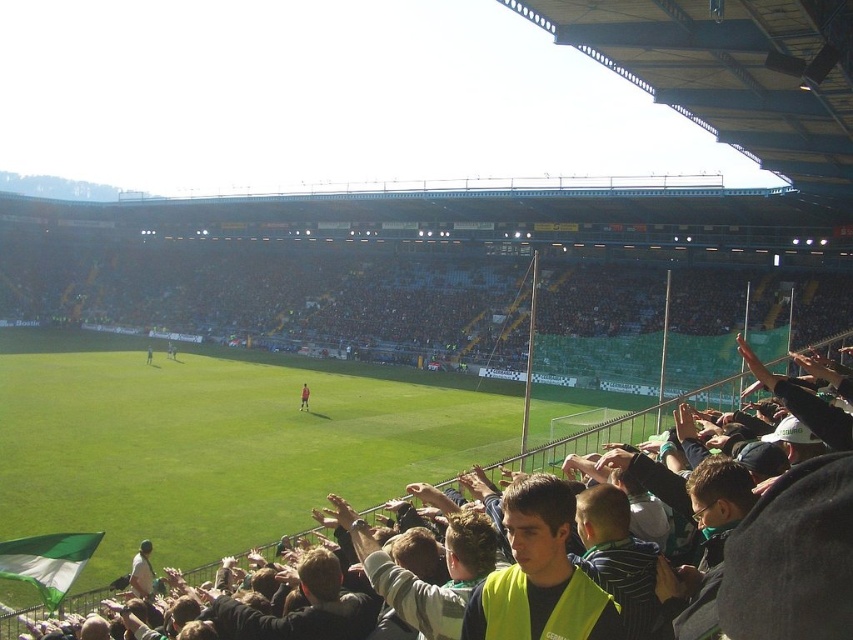
Question: Which point appears closest to the camera in this image?

Choices:
 (A) (592, 604)
 (B) (837, 340)

Answer: (A)

Question: Which is nearer to the yellow-green jersey at lower center?

Choices:
 (A) light brown leather jacket at lower left
 (B) dark green jersey at center
 (C) yellow safety vest at center

Answer: (C)

Question: Does yellow-green jersey at lower center have a larger size compared to dark green jersey at center?

Choices:
 (A) no
 (B) yes

Answer: (B)

Question: Is yellow-green jersey at lower center to the left of dark green jersey at center from the viewer's perspective?

Choices:
 (A) yes
 (B) no

Answer: (B)

Question: Which of these objects is positioned closest to the dark green jersey at center?

Choices:
 (A) yellow-green jersey at lower center
 (B) yellow safety vest at center

Answer: (A)

Question: Is light brown leather jacket at lower left in front of dark green jersey at center?

Choices:
 (A) no
 (B) yes

Answer: (B)